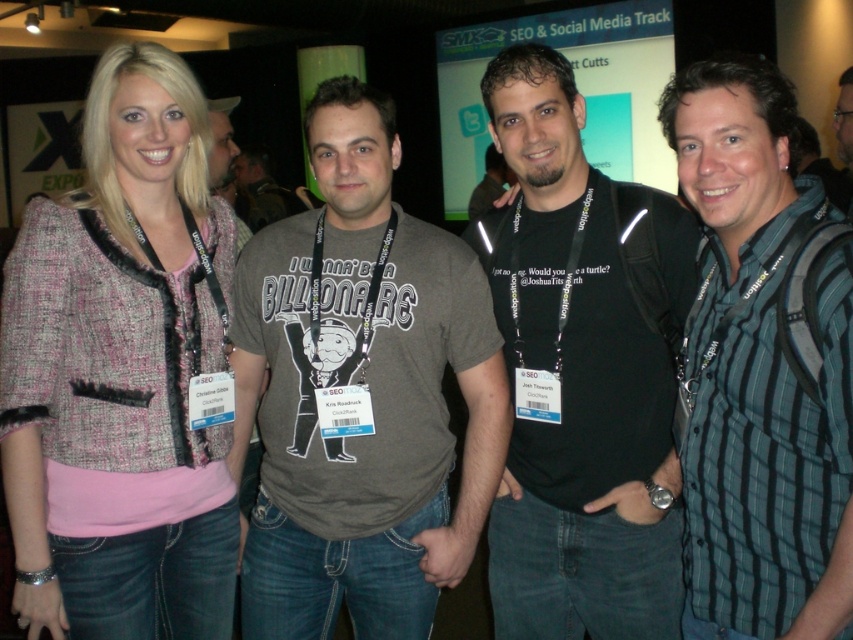
You are standing at the front of the stage at the SMX Expo. You see two points marked on the floor where attendees are standing. The first point is at coordinate point (169, 584) and the second is at coordinate point (578, 195). Which point is closer to you?

Point (169, 584) is closer to the camera than point (578, 195), so the first point is closer to you.